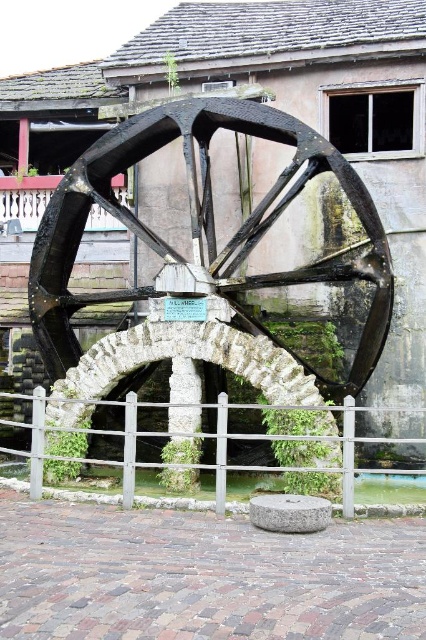
Question: Which of the following is the closest to the observer?

Choices:
 (A) clear water at center
 (B) dark brown wooden wagon wheel at center

Answer: (A)

Question: Can you confirm if dark brown wooden wagon wheel at center is positioned below clear water at center?

Choices:
 (A) no
 (B) yes

Answer: (A)

Question: Does dark brown wooden wagon wheel at center appear on the right side of clear water at center?

Choices:
 (A) no
 (B) yes

Answer: (B)

Question: Observing the image, what is the correct spatial positioning of dark brown wooden wagon wheel at center in reference to clear water at center?

Choices:
 (A) below
 (B) above

Answer: (B)

Question: Which point appears closest to the camera in this image?

Choices:
 (A) (204, 173)
 (B) (210, 496)

Answer: (B)